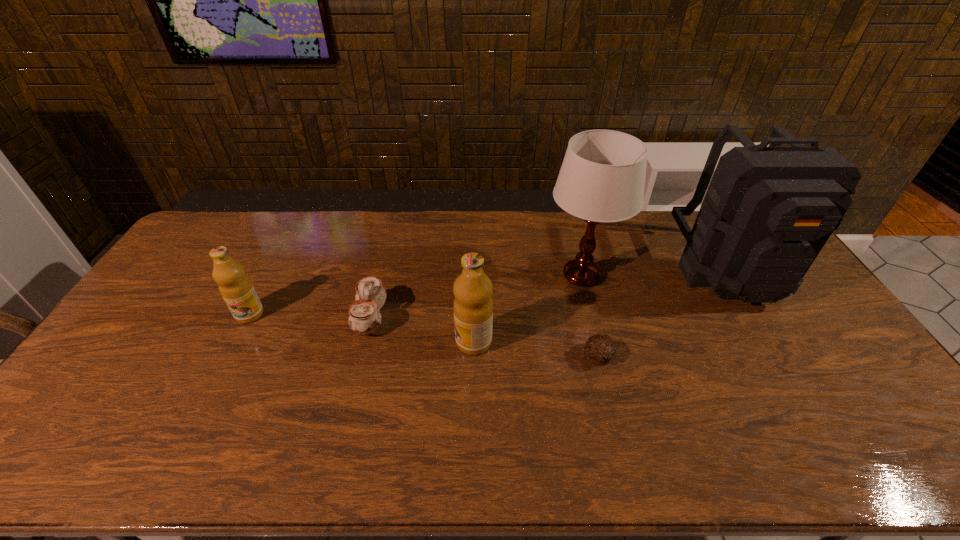
This screenshot has height=540, width=960. What are the coordinates of `vacant area located 0.160m on the label of the third object from left to right` in the screenshot? It's located at (399, 342).

Where is `free spot located on the label of the third object from left to right`? The width and height of the screenshot is (960, 540). free spot located on the label of the third object from left to right is located at coordinates coord(365,342).

At what (x,y) coordinates should I click in order to perform the action: click on vacant space situated on the label of the third object from left to right. Please return your answer as a coordinate pair (x, y). Looking at the image, I should click on (337, 342).

Image resolution: width=960 pixels, height=540 pixels. What are the coordinates of `vacant space situated 0.300m by the handle of the second shortest object` in the screenshot? It's located at (486, 318).

I want to click on vacant space located 0.370m on the front compartment of the backpack, so click(825, 423).

Identify the location of vacant space located 0.310m on the right of the shortest object. The height and width of the screenshot is (540, 960). (725, 356).

The height and width of the screenshot is (540, 960). In order to click on vacant space situated 0.150m on the left of the table lamp in this screenshot , I will do `click(498, 276)`.

Find the location of a particular element. This screenshot has height=540, width=960. object that is positioned at the far edge is located at coordinates (768, 211).

At what (x,y) coordinates should I click in order to perform the action: click on object at the right edge. Please return your answer as a coordinate pair (x, y). The image size is (960, 540). Looking at the image, I should click on (768, 211).

Where is `object that is at the far right corner`? The image size is (960, 540). object that is at the far right corner is located at coordinates (768, 211).